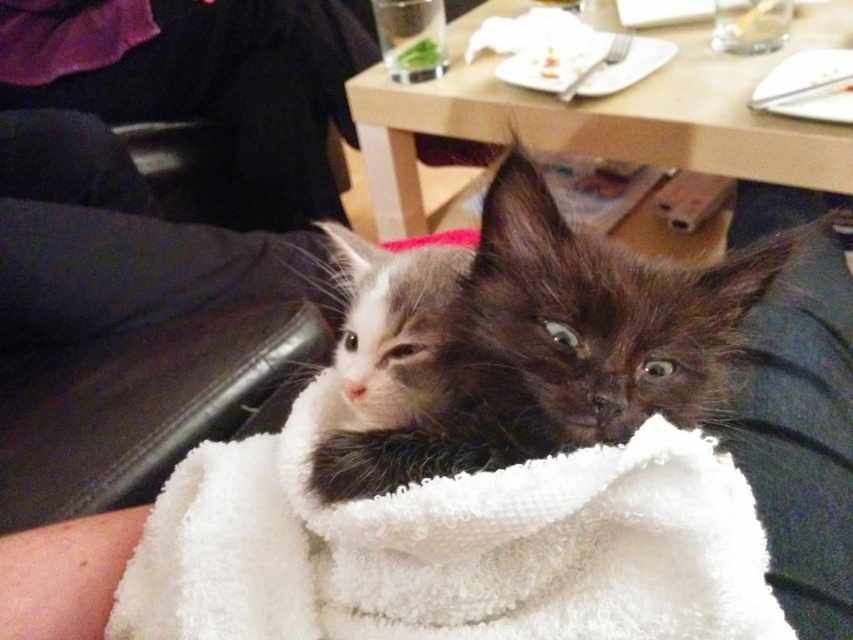
Question: Can you confirm if white fluffy blanket at center is wider than fluffy brown kitten at center?

Choices:
 (A) yes
 (B) no

Answer: (A)

Question: Does white fluffy blanket at center appear under fluffy brown kitten at center?

Choices:
 (A) yes
 (B) no

Answer: (A)

Question: Is white fluffy blanket at center to the left of fluffy brown kitten at center from the viewer's perspective?

Choices:
 (A) no
 (B) yes

Answer: (B)

Question: Which point appears closest to the camera in this image?

Choices:
 (A) (386, 616)
 (B) (651, 349)

Answer: (A)